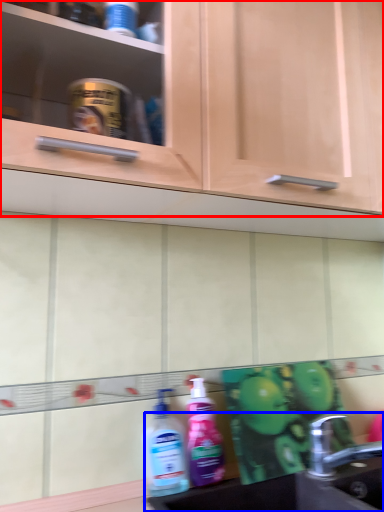
Question: Which object appears closest to the camera in this image, cabinetry (highlighted by a red box) or sink (highlighted by a blue box)?

Choices:
 (A) cabinetry
 (B) sink

Answer: (A)